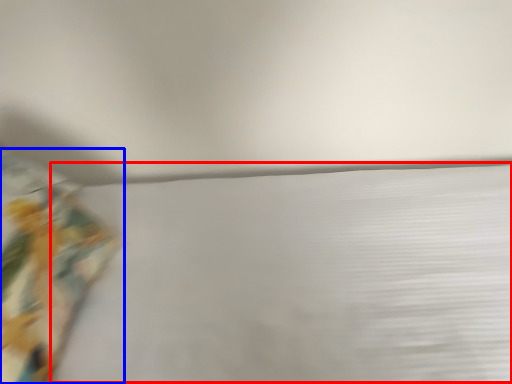
Question: Which of the following is the closest to the observer, sheet (highlighted by a red box) or curtain (highlighted by a blue box)?

Choices:
 (A) sheet
 (B) curtain

Answer: (A)